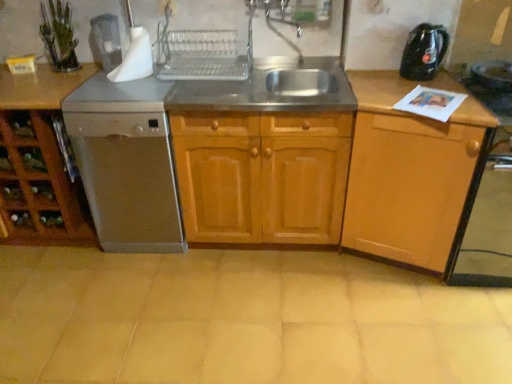
Where is `vacant space in black plastic kettle at upper right (from a real-world perspective)`? vacant space in black plastic kettle at upper right (from a real-world perspective) is located at coordinates (419, 79).